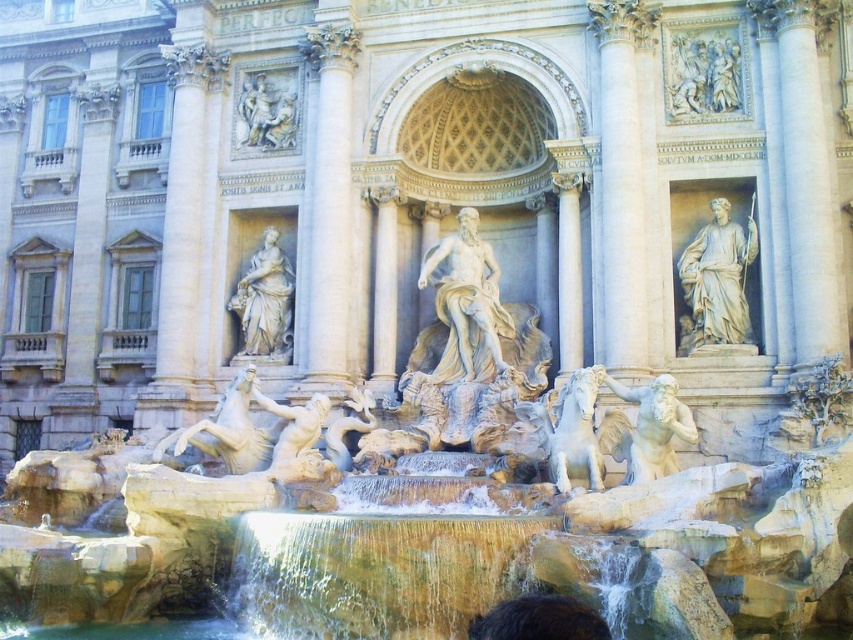
You are a tourist standing in front of the Trevi Fountain and want to take a photo of both the white marble horse at center and the smooth stone figure at center. Based on their positions, which one should you point your camera at first to ensure both are in the frame?

The white marble horse at center is below the smooth stone figure at center, so you should aim your camera at the smooth stone figure at center first to include both in the frame.

You are a tourist visiting the Trevi Fountain and want to take a photo that includes both the white marble relief at upper right and the smooth stone figure at center. Which of the two objects should you focus on first to ensure both are in the frame?

The white marble relief at upper right is not as tall as the smooth stone figure at center, so you should focus on the smooth stone figure at center first to ensure both are in the frame.

You are visiting the Trevi Fountain and want to take a photo that includes both the white marble relief at upper right and the smooth stone figure at center. Which object should you focus on first to ensure both are in frame?

You should focus on the smooth stone figure at center first because it is larger than the white marble relief at upper right, ensuring it fits within the frame while still capturing the smaller relief.